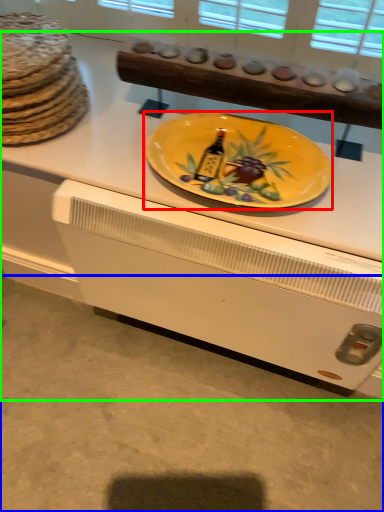
Question: Which is nearer to the plate (highlighted by a red box)? concrete (highlighted by a blue box) or desk (highlighted by a green box).

Choices:
 (A) concrete
 (B) desk

Answer: (B)